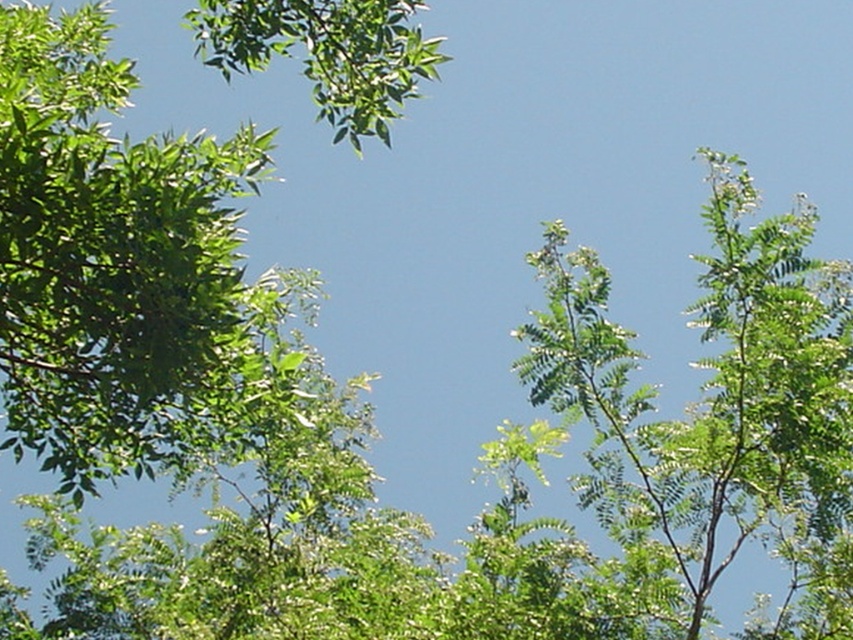
Question: Which point is farther to the camera?

Choices:
 (A) green leafy branch at upper left
 (B) green leafy tree at upper left
 (C) green leafy tree at upper right

Answer: (C)

Question: Can you confirm if green leafy tree at upper left is smaller than green leafy branch at upper left?

Choices:
 (A) no
 (B) yes

Answer: (A)

Question: Does green leafy tree at upper left have a larger size compared to green leafy tree at upper right?

Choices:
 (A) yes
 (B) no

Answer: (A)

Question: Is green leafy tree at upper left to the right of green leafy tree at upper right from the viewer's perspective?

Choices:
 (A) no
 (B) yes

Answer: (A)

Question: Among these points, which one is nearest to the camera?

Choices:
 (A) (778, 253)
 (B) (306, 19)
 (C) (198, 305)

Answer: (C)

Question: Among these objects, which one is nearest to the camera?

Choices:
 (A) green leafy branch at upper left
 (B) green leafy tree at upper right

Answer: (A)